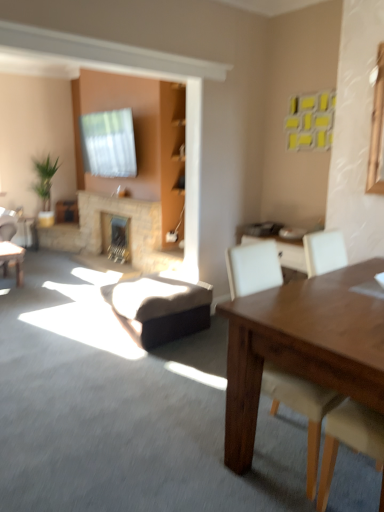
Describe the element at coordinates (110, 224) in the screenshot. I see `natural stone fireplace at center, positioned as the 1th fireplace in front-to-back order` at that location.

Identify the location of brown leather swivel chair at center. (160, 308).

This screenshot has width=384, height=512. Identify the location of white leather chair at right. (301, 410).

Where is `green leafy plant at left`? green leafy plant at left is located at coordinates (45, 188).

In terms of height, does green leafy plant at left look taller or shorter compared to white leather chair at right?

green leafy plant at left is taller than white leather chair at right.

Considering the relative positions of green leafy plant at left and white leather chair at right in the image provided, is green leafy plant at left to the left or to the right of white leather chair at right?

Clearly, green leafy plant at left is on the left of white leather chair at right in the image.

From the image's perspective, is green leafy plant at left above white leather chair at right?

Correct, green leafy plant at left appears higher than white leather chair at right in the image.

Can you tell me how much stone fireplace at center, the 2th fireplace in the front-to-back sequence, and natural stone fireplace at center, positioned as the 1th fireplace in front-to-back order, differ in facing direction?

stone fireplace at center, the 2th fireplace in the front-to-back sequence, and natural stone fireplace at center, positioned as the 1th fireplace in front-to-back order, are facing 0.00896 degrees away from each other.

From the image's perspective, between stone fireplace at center, the 2th fireplace in the front-to-back sequence, and natural stone fireplace at center, positioned as the 1th fireplace in front-to-back order, which one is located above?

natural stone fireplace at center, positioned as the 1th fireplace in front-to-back order.

Locate an element on the screen. fireplace lying on the right of natural stone fireplace at center, which ranks as the second fireplace in back-to-front order is located at coordinates (116, 237).

Is stone fireplace at center, the first fireplace positioned from the back, directly adjacent to natural stone fireplace at center, which ranks as the second fireplace in back-to-front order?

There is a gap between stone fireplace at center, the first fireplace positioned from the back, and natural stone fireplace at center, which ranks as the second fireplace in back-to-front order.

Is natural stone fireplace at center, which ranks as the second fireplace in back-to-front order, wider than stone fireplace at center, the first fireplace positioned from the back?

In fact, natural stone fireplace at center, which ranks as the second fireplace in back-to-front order, might be narrower than stone fireplace at center, the first fireplace positioned from the back.

From the image's perspective, is natural stone fireplace at center, positioned as the 1th fireplace in front-to-back order, located beneath stone fireplace at center, the 2th fireplace in the front-to-back sequence?

No, from the image's perspective, natural stone fireplace at center, positioned as the 1th fireplace in front-to-back order, is not beneath stone fireplace at center, the 2th fireplace in the front-to-back sequence.

From a real-world perspective, is natural stone fireplace at center, positioned as the 1th fireplace in front-to-back order, below stone fireplace at center, the 2th fireplace in the front-to-back sequence?

Actually, natural stone fireplace at center, positioned as the 1th fireplace in front-to-back order, is physically above stone fireplace at center, the 2th fireplace in the front-to-back sequence, in the real world.

How many degrees apart are the facing directions of natural stone fireplace at center, which ranks as the second fireplace in back-to-front order, and stone fireplace at center, the first fireplace positioned from the back?

The facing directions of natural stone fireplace at center, which ranks as the second fireplace in back-to-front order, and stone fireplace at center, the first fireplace positioned from the back, are 0.00896 degrees apart.

Considering the sizes of objects stone fireplace at center, the 2th fireplace in the front-to-back sequence, and green leafy plant at left in the image provided, who is shorter, stone fireplace at center, the 2th fireplace in the front-to-back sequence, or green leafy plant at left?

stone fireplace at center, the 2th fireplace in the front-to-back sequence.

Where is `houseplant that appears behind the stone fireplace at center, the first fireplace positioned from the back`? Image resolution: width=384 pixels, height=512 pixels. houseplant that appears behind the stone fireplace at center, the first fireplace positioned from the back is located at coordinates (45, 188).

Looking at this image, what's the angular difference between stone fireplace at center, the first fireplace positioned from the back, and green leafy plant at left's facing directions?

They differ by 89.7 degrees in their facing directions.

Looking at this image, would you consider stone fireplace at center, the first fireplace positioned from the back, to be distant from green leafy plant at left?

stone fireplace at center, the first fireplace positioned from the back, is far away from green leafy plant at left.

From a real-world perspective, between brown leather swivel chair at center and green leafy plant at left, who is vertically higher?

In real-world perspective, green leafy plant at left is above.

Based on the photo, is brown leather swivel chair at center inside or outside of green leafy plant at left?

brown leather swivel chair at center is not inside green leafy plant at left, it's outside.

Does brown leather swivel chair at center touch green leafy plant at left?

No, brown leather swivel chair at center is not with green leafy plant at left.

Would you say brown leather swivel chair at center is inside or outside white leather chair at right?

brown leather swivel chair at center cannot be found inside white leather chair at right.

Can you see brown leather swivel chair at center touching white leather chair at right?

No, brown leather swivel chair at center is not touching white leather chair at right.

Find the location of a particular element. chair in front of the brown leather swivel chair at center is located at coordinates (301, 410).

Considering the relative sizes of brown leather swivel chair at center and white leather chair at right in the image provided, is brown leather swivel chair at center bigger than white leather chair at right?

Incorrect, brown leather swivel chair at center is not larger than white leather chair at right.

From a real-world perspective, between natural stone fireplace at center, positioned as the 1th fireplace in front-to-back order, and white leather chair at right, who is vertically higher?

From a 3D spatial view, white leather chair at right is above.

How many degrees apart are the facing directions of natural stone fireplace at center, which ranks as the second fireplace in back-to-front order, and white leather chair at right?

The angular difference between natural stone fireplace at center, which ranks as the second fireplace in back-to-front order, and white leather chair at right is 92.9 degrees.

Would you say natural stone fireplace at center, which ranks as the second fireplace in back-to-front order, is outside white leather chair at right?

Yes.

This screenshot has height=512, width=384. In order to click on chair above the natural stone fireplace at center, positioned as the 1th fireplace in front-to-back order (from a real-world perspective) in this screenshot , I will do `click(301, 410)`.

Where is `chair located in front of the green leafy plant at left`? The height and width of the screenshot is (512, 384). chair located in front of the green leafy plant at left is located at coordinates (301, 410).

Identify the location of fireplace above the stone fireplace at center, the first fireplace positioned from the back (from the image's perspective). This screenshot has height=512, width=384. (110, 224).

Considering their positions, is green leafy plant at left positioned further to brown leather swivel chair at center than natural stone fireplace at center, positioned as the 1th fireplace in front-to-back order?

green leafy plant at left is further to brown leather swivel chair at center.

Based on their spatial positions, is green leafy plant at left or natural stone fireplace at center, which ranks as the second fireplace in back-to-front order, further from white leather chair at right?

The object further to white leather chair at right is green leafy plant at left.

Considering their positions, is natural stone fireplace at center, positioned as the 1th fireplace in front-to-back order, positioned further to brown leather swivel chair at center than white leather chair at right?

Among the two, natural stone fireplace at center, positioned as the 1th fireplace in front-to-back order, is located further to brown leather swivel chair at center.

Which object lies further to the anchor point natural stone fireplace at center, which ranks as the second fireplace in back-to-front order, stone fireplace at center, the first fireplace positioned from the back, or green leafy plant at left?

Among the two, green leafy plant at left is located further to natural stone fireplace at center, which ranks as the second fireplace in back-to-front order.

Considering their positions, is brown leather swivel chair at center positioned closer to stone fireplace at center, the 2th fireplace in the front-to-back sequence, than white leather chair at right?

Among the two, brown leather swivel chair at center is located nearer to stone fireplace at center, the 2th fireplace in the front-to-back sequence.

Looking at the image, which one is located closer to white leather chair at right, green leafy plant at left or brown leather swivel chair at center?

brown leather swivel chair at center lies closer to white leather chair at right than the other object.

When comparing their distances from brown leather swivel chair at center, does natural stone fireplace at center, positioned as the 1th fireplace in front-to-back order, or green leafy plant at left seem further?

green leafy plant at left lies further to brown leather swivel chair at center than the other object.

Estimate the real-world distances between objects in this image. Which object is closer to white leather chair at right, stone fireplace at center, the 2th fireplace in the front-to-back sequence, or green leafy plant at left?

stone fireplace at center, the 2th fireplace in the front-to-back sequence.

Image resolution: width=384 pixels, height=512 pixels. Identify the location of swivel chair between white leather chair at right and stone fireplace at center, the first fireplace positioned from the back, in the front-back direction. (160, 308).

This screenshot has width=384, height=512. Identify the location of fireplace situated between green leafy plant at left and stone fireplace at center, the 2th fireplace in the front-to-back sequence, from left to right. (110, 224).

Find the location of a particular element. fireplace between brown leather swivel chair at center and stone fireplace at center, the 2th fireplace in the front-to-back sequence, from front to back is located at coordinates (110, 224).

In order to click on fireplace located between white leather chair at right and stone fireplace at center, the first fireplace positioned from the back, in the depth direction in this screenshot , I will do `click(110, 224)`.